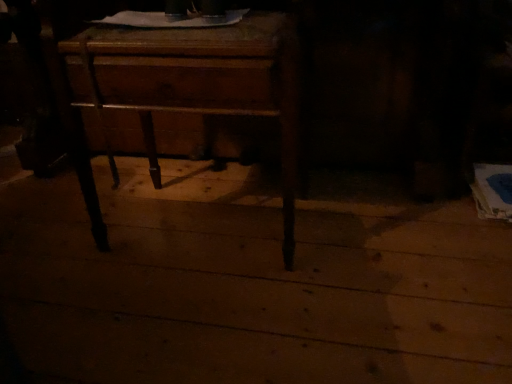
Identify the location of free space to the left of wooden drawer at center. (52, 249).